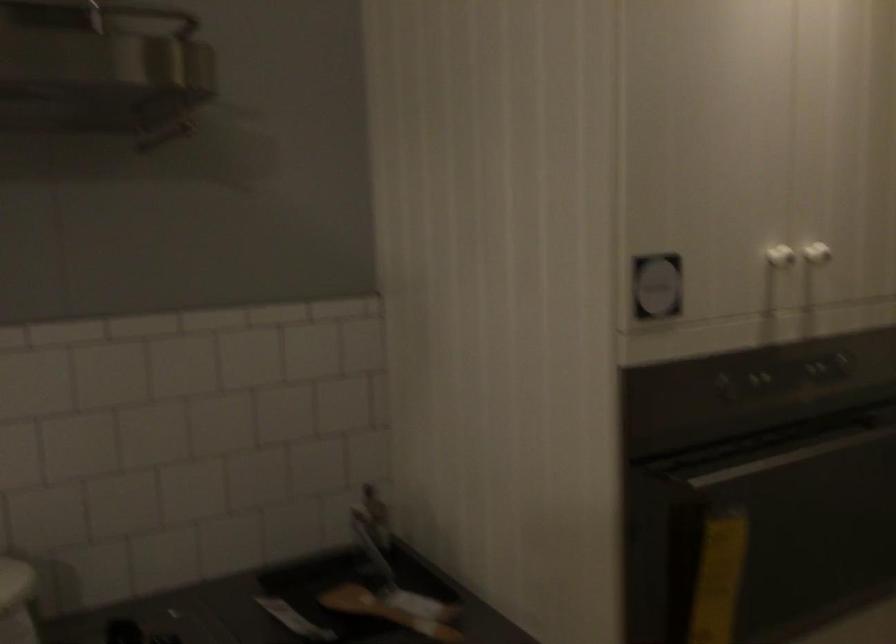
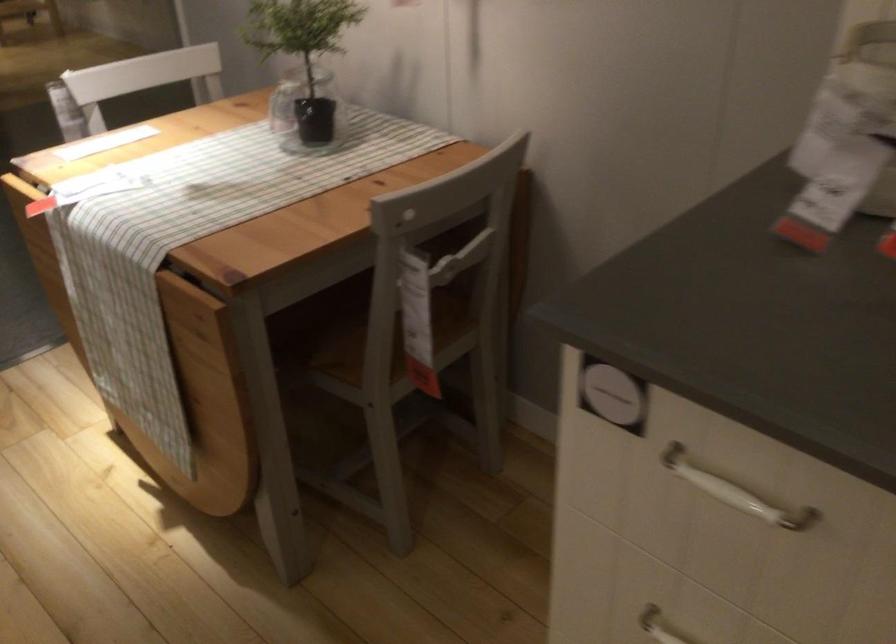
The images are taken continuously from a first-person perspective. In which direction is your viewpoint rotating?

The camera rotated toward left-down.